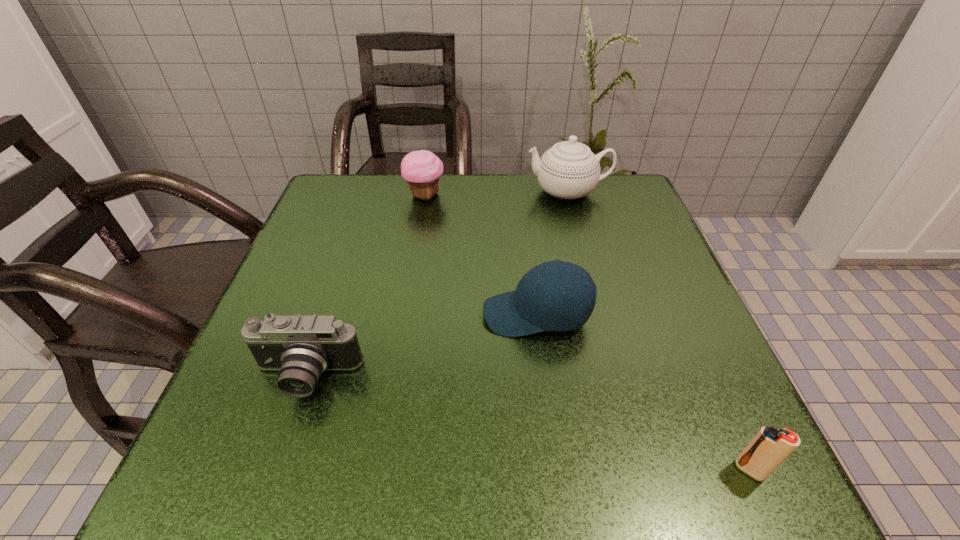
Identify the location of free space between the rightmost object and the leftmost object. (528, 424).

Locate which object is the closest to the second object from left to right. Please provide its 2D coordinates. Your answer should be formatted as a tuple, i.e. [(x, y)], where the tuple contains the x and y coordinates of a point satisfying the conditions above.

[(569, 170)]

Locate which object ranks fourth in proximity to the third nearest object. Please provide its 2D coordinates. Your answer should be formatted as a tuple, i.e. [(x, y)], where the tuple contains the x and y coordinates of a point satisfying the conditions above.

[(422, 169)]

This screenshot has width=960, height=540. Find the location of `vacant point that satisfies the following two spatial constraints: 1. on the front-facing side of the rightmost object; 2. on the right side of the camera`. vacant point that satisfies the following two spatial constraints: 1. on the front-facing side of the rightmost object; 2. on the right side of the camera is located at coordinates (276, 470).

The image size is (960, 540). Identify the location of free space that satisfies the following two spatial constraints: 1. on the front-facing side of the camera; 2. on the left side of the rightmost object. (276, 470).

Where is `vacant region that satisfies the following two spatial constraints: 1. on the front-facing side of the leftmost object; 2. on the left side of the rightmost object`? The width and height of the screenshot is (960, 540). vacant region that satisfies the following two spatial constraints: 1. on the front-facing side of the leftmost object; 2. on the left side of the rightmost object is located at coordinates (276, 470).

The image size is (960, 540). What are the coordinates of `vacant region that satisfies the following two spatial constraints: 1. on the back side of the nearest object; 2. on the front-facing side of the baseball cap` in the screenshot? It's located at (681, 314).

The height and width of the screenshot is (540, 960). Find the location of `free region that satisfies the following two spatial constraints: 1. on the front-facing side of the fourth farthest object; 2. on the left side of the nearest object`. free region that satisfies the following two spatial constraints: 1. on the front-facing side of the fourth farthest object; 2. on the left side of the nearest object is located at coordinates (276, 470).

The width and height of the screenshot is (960, 540). In order to click on vacant space that satisfies the following two spatial constraints: 1. on the front side of the second object from left to right; 2. on the right side of the rightmost object in this screenshot , I will do `click(378, 470)`.

This screenshot has width=960, height=540. Identify the location of vacant space that satisfies the following two spatial constraints: 1. on the spout of the chinaware; 2. on the front-facing side of the fourth farthest object. (617, 377).